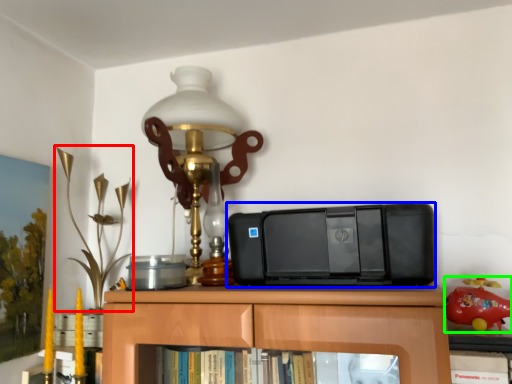
Question: Which is nearer to the toy (highlighted by a red box)? printer (highlighted by a blue box) or toy (highlighted by a green box).

Choices:
 (A) printer
 (B) toy

Answer: (A)